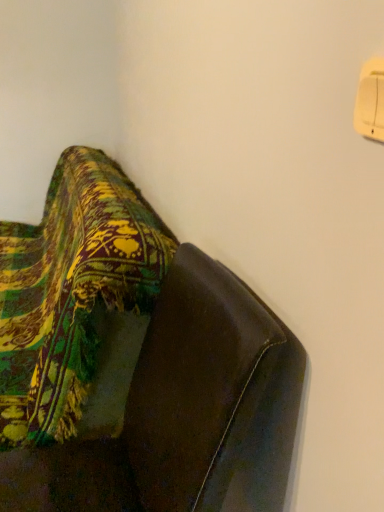
This screenshot has width=384, height=512. What do you see at coordinates (136, 362) in the screenshot? I see `leather couch at lower left` at bounding box center [136, 362].

You are a GUI agent. You are given a task and a screenshot of the screen. Output one action in this format:
    pyautogui.click(x=<x>, y=<y>)
    Task: Click on the leather couch at lower left
    The height and width of the screenshot is (512, 384).
    Given the screenshot: What is the action you would take?
    pyautogui.click(x=136, y=362)

Identify the location of leather couch at lower left. (136, 362).